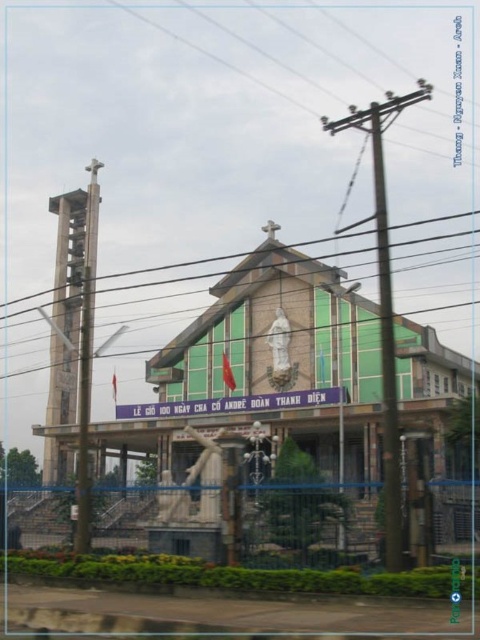
Between brown wooden telegraph pole at upper center and metallic gray telegraph pole at left, which one is positioned higher?

brown wooden telegraph pole at upper center is higher up.

Between point (391, 467) and point (76, 476), which one is positioned behind?

Point (76, 476)

This screenshot has width=480, height=640. Identify the location of brown wooden telegraph pole at upper center. (384, 304).

Between green stone church at center and brown wooden telegraph pole at upper center, which one appears on the right side from the viewer's perspective?

brown wooden telegraph pole at upper center

Is green stone church at center further to camera compared to brown wooden telegraph pole at upper center?

That is True.

You are a GUI agent. You are given a task and a screenshot of the screen. Output one action in this format:
    pyautogui.click(x=<x>, y=<y>)
    Task: Click on the green stone church at center
    This screenshot has height=640, width=480.
    Given the screenshot: What is the action you would take?
    pyautogui.click(x=266, y=365)

The width and height of the screenshot is (480, 640). I want to click on green stone church at center, so click(266, 365).

Can you confirm if green stone church at center is positioned below metallic gray telegraph pole at left?

Yes.

Between green stone church at center and metallic gray telegraph pole at left, which one appears on the right side from the viewer's perspective?

Positioned to the right is green stone church at center.

From the picture: Measure the distance between point (118, 429) and camera.

They are 117.30 meters apart.

You are a GUI agent. You are given a task and a screenshot of the screen. Output one action in this format:
    pyautogui.click(x=<x>, y=<y>)
    Task: Click on the green stone church at center
    
    Given the screenshot: What is the action you would take?
    pyautogui.click(x=266, y=365)